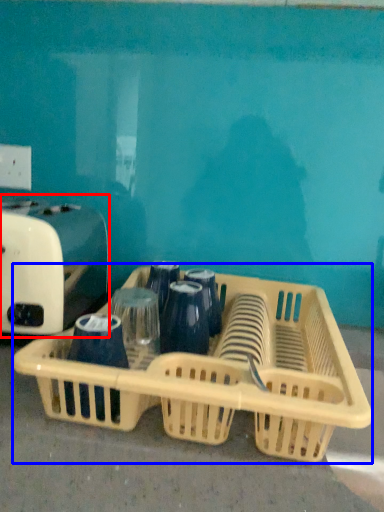
Question: Which object appears closest to the camera in this image, toaster (highlighted by a red box) or basket (highlighted by a blue box)?

Choices:
 (A) toaster
 (B) basket

Answer: (B)